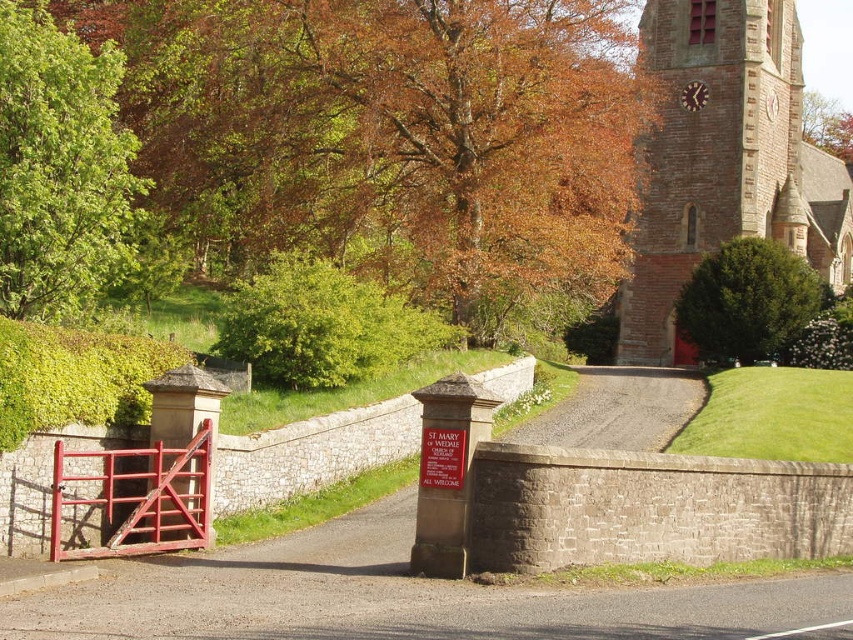
Question: Is green leafy bush at upper right positioned behind brown textured tree at upper right?

Choices:
 (A) no
 (B) yes

Answer: (A)

Question: Which point appears closest to the camera in this image?

Choices:
 (A) (830, 102)
 (B) (759, 45)
 (C) (727, 339)

Answer: (C)

Question: Which point appears closest to the camera in this image?

Choices:
 (A) (817, 104)
 (B) (80, 132)

Answer: (B)

Question: Is brown stone church at upper right above green leafy bush at upper right?

Choices:
 (A) yes
 (B) no

Answer: (A)

Question: Can you confirm if green leafy tree at upper left is smaller than green leafy bush at upper right?

Choices:
 (A) no
 (B) yes

Answer: (A)

Question: Based on their relative distances, which object is farther from the green leafy bush at upper right?

Choices:
 (A) green leafy tree at upper left
 (B) brown textured tree at upper right
 (C) brown stone church at upper right

Answer: (A)